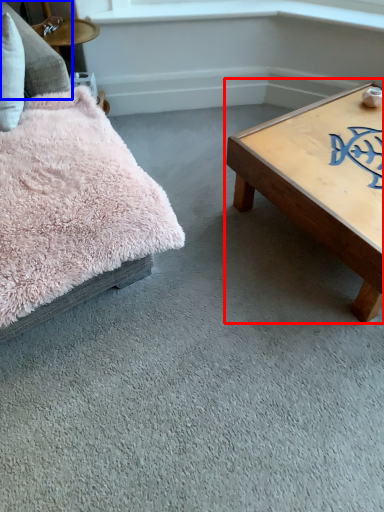
Question: Among these objects, which one is farthest to the camera, coffee table (highlighted by a red box) or pillow (highlighted by a blue box)?

Choices:
 (A) coffee table
 (B) pillow

Answer: (A)